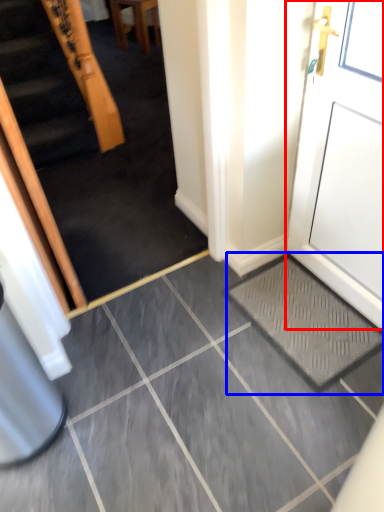
Question: Which of the following is the farthest to the observer, door (highlighted by a red box) or doormat (highlighted by a blue box)?

Choices:
 (A) door
 (B) doormat

Answer: (B)